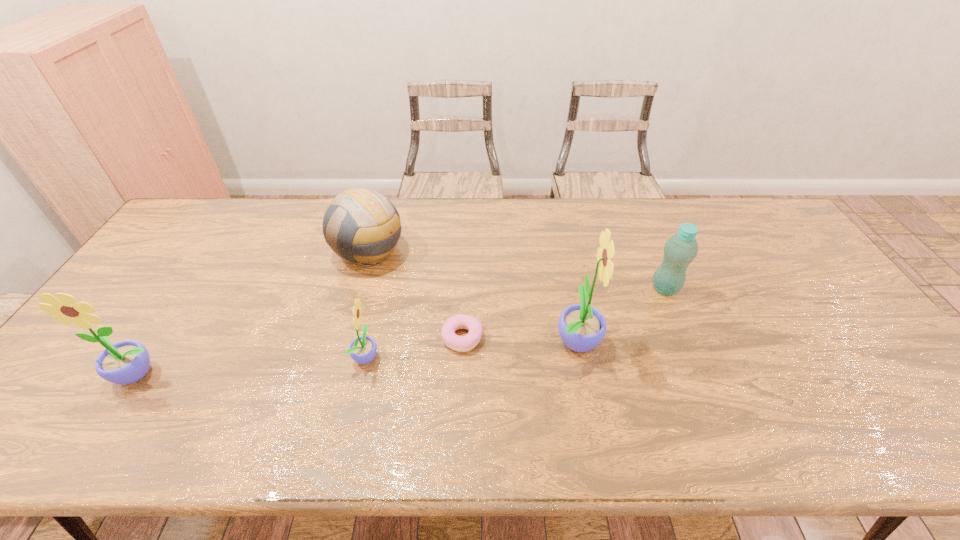
I want to click on vacant region located on the front-facing side of the fifth object from left to right, so click(627, 339).

Locate an element on the screen. vacant space located at the front cap of the second farthest object is located at coordinates (540, 289).

Image resolution: width=960 pixels, height=540 pixels. I want to click on free spot located 0.170m at the front cap of the second farthest object, so click(592, 289).

This screenshot has height=540, width=960. Find the location of `free space located at the front cap of the second farthest object`. free space located at the front cap of the second farthest object is located at coordinates (523, 289).

Where is `vacant point located on the left of the farthest object`? vacant point located on the left of the farthest object is located at coordinates (228, 251).

This screenshot has width=960, height=540. Find the location of `vacant space situated on the right of the pastry`. vacant space situated on the right of the pastry is located at coordinates (536, 337).

You are a GUI agent. You are given a task and a screenshot of the screen. Output one action in this format:
    pyautogui.click(x=<x>, y=<y>)
    Task: Click on the object that is at the far edge
    This screenshot has height=540, width=960.
    Given the screenshot: What is the action you would take?
    pyautogui.click(x=360, y=225)

Locate an element on the screen. object that is at the near edge is located at coordinates (126, 362).

Locate an element on the screen. The width and height of the screenshot is (960, 540). object that is at the left edge is located at coordinates (126, 362).

Identify the location of object present at the near left corner. (126, 362).